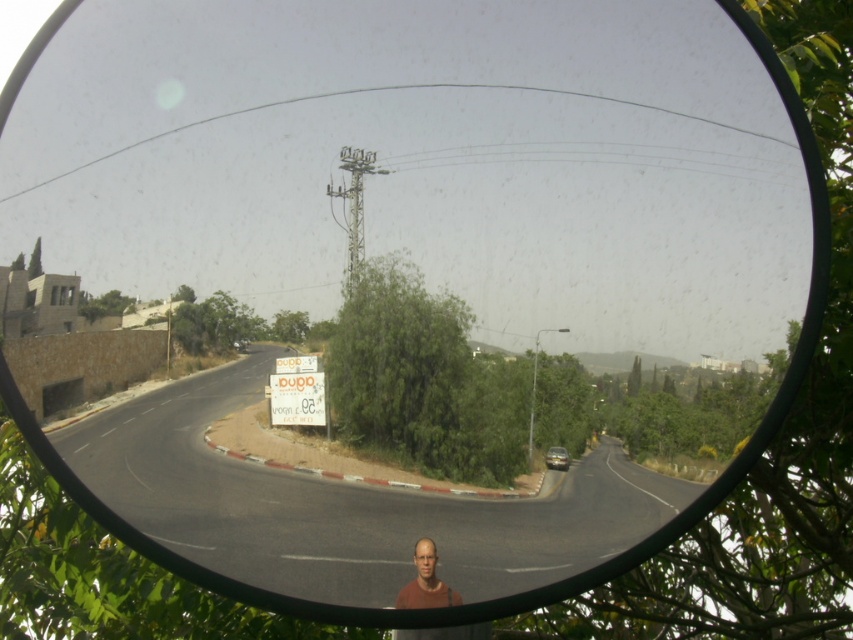
Consider the image. Who is higher up, white paper sign at center or silver metallic car at center?

white paper sign at center

Is point (318, 419) in front of point (567, 467)?

No, (318, 419) is behind (567, 467).

Who is more distant from viewer, (322,372) or (553,460)?

The point (553,460) is behind.

Where is `white paper sign at center`? The height and width of the screenshot is (640, 853). white paper sign at center is located at coordinates (296, 392).

How far apart are smooth brown shirt at lower center and silver metallic car at center?

A distance of 7.21 inches exists between smooth brown shirt at lower center and silver metallic car at center.

Does smooth brown shirt at lower center appear over silver metallic car at center?

Actually, smooth brown shirt at lower center is below silver metallic car at center.

What do you see at coordinates (425, 580) in the screenshot?
I see `smooth brown shirt at lower center` at bounding box center [425, 580].

Locate an element on the screen. This screenshot has height=640, width=853. smooth brown shirt at lower center is located at coordinates (425, 580).

Between white paper sign at center and smooth brown shirt at lower center, which one is positioned lower?

smooth brown shirt at lower center is below.

The width and height of the screenshot is (853, 640). Describe the element at coordinates (296, 392) in the screenshot. I see `white paper sign at center` at that location.

I want to click on white paper sign at center, so click(x=296, y=392).